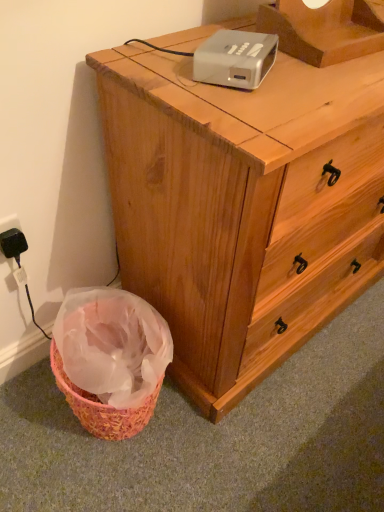
Question: Is white plastic projector at upper center aimed at black plastic electric outlet at lower left?

Choices:
 (A) yes
 (B) no

Answer: (B)

Question: Is white plastic projector at upper center shorter than black plastic electric outlet at lower left?

Choices:
 (A) no
 (B) yes

Answer: (B)

Question: Does white plastic projector at upper center have a greater height compared to black plastic electric outlet at lower left?

Choices:
 (A) yes
 (B) no

Answer: (B)

Question: Is white plastic projector at upper center to the left of black plastic electric outlet at lower left from the viewer's perspective?

Choices:
 (A) yes
 (B) no

Answer: (B)

Question: From the image's perspective, is white plastic projector at upper center over black plastic electric outlet at lower left?

Choices:
 (A) no
 (B) yes

Answer: (B)

Question: Is white plastic projector at upper center outside black plastic electric outlet at lower left?

Choices:
 (A) yes
 (B) no

Answer: (A)

Question: Considering the relative sizes of wooden chest of drawers at center and white plastic projector at upper center in the image provided, is wooden chest of drawers at center bigger than white plastic projector at upper center?

Choices:
 (A) yes
 (B) no

Answer: (A)

Question: From the image's perspective, is wooden chest of drawers at center beneath white plastic projector at upper center?

Choices:
 (A) yes
 (B) no

Answer: (A)

Question: Is wooden chest of drawers at center positioned with its back to white plastic projector at upper center?

Choices:
 (A) no
 (B) yes

Answer: (A)

Question: Considering the relative sizes of wooden chest of drawers at center and white plastic projector at upper center in the image provided, is wooden chest of drawers at center smaller than white plastic projector at upper center?

Choices:
 (A) no
 (B) yes

Answer: (A)

Question: Can you confirm if wooden chest of drawers at center is positioned to the right of white plastic projector at upper center?

Choices:
 (A) no
 (B) yes

Answer: (B)

Question: From a real-world perspective, is wooden chest of drawers at center positioned under white plastic projector at upper center based on gravity?

Choices:
 (A) no
 (B) yes

Answer: (B)

Question: Can you confirm if black plastic electric outlet at lower left is bigger than wooden chest of drawers at center?

Choices:
 (A) yes
 (B) no

Answer: (B)